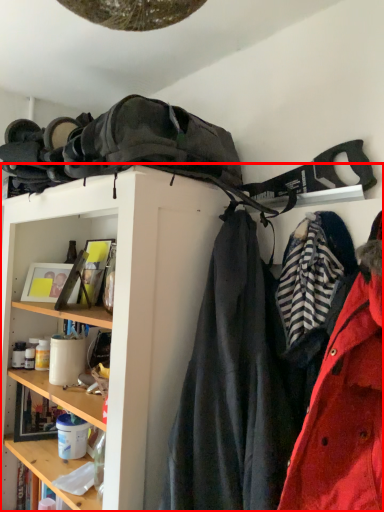
Question: Considering the relative positions of shelf (annotated by the red box) and coat in the image provided, where is shelf (annotated by the red box) located with respect to the staircase?

Choices:
 (A) left
 (B) right

Answer: (A)